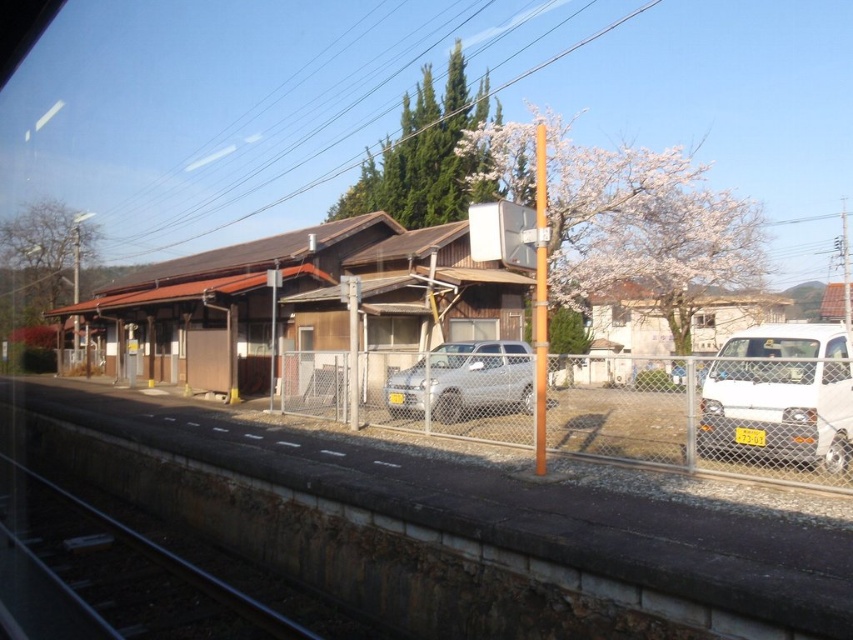
Question: Observing the image, what is the correct spatial positioning of metallic chain-link fence at center in reference to white matte van at right?

Choices:
 (A) below
 (B) above

Answer: (A)

Question: Among these points, which one is farthest from the camera?

Choices:
 (A) (416, 406)
 (B) (419, 394)
 (C) (489, 320)

Answer: (C)

Question: Is brown wooden building at center below white matte van at right?

Choices:
 (A) yes
 (B) no

Answer: (B)

Question: Estimate the real-world distances between objects in this image. Which object is farther from the brown wooden building at center?

Choices:
 (A) white matte van at right
 (B) black metal train track at lower left

Answer: (A)

Question: Which point is closer to the camera?

Choices:
 (A) (134, 292)
 (B) (107, 529)
 (C) (426, 362)

Answer: (B)

Question: In this image, where is brown wooden building at center located relative to satin silver car at center?

Choices:
 (A) right
 (B) left

Answer: (B)